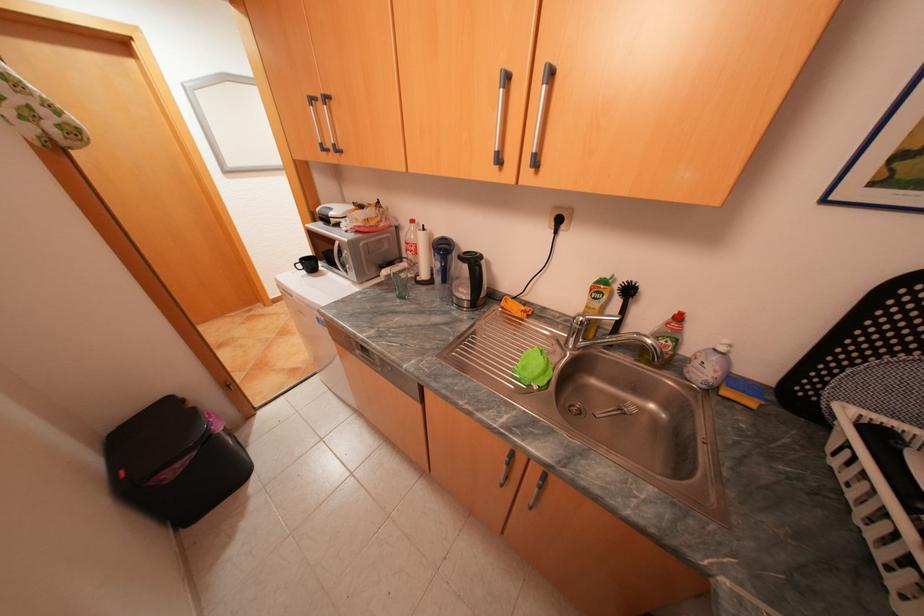
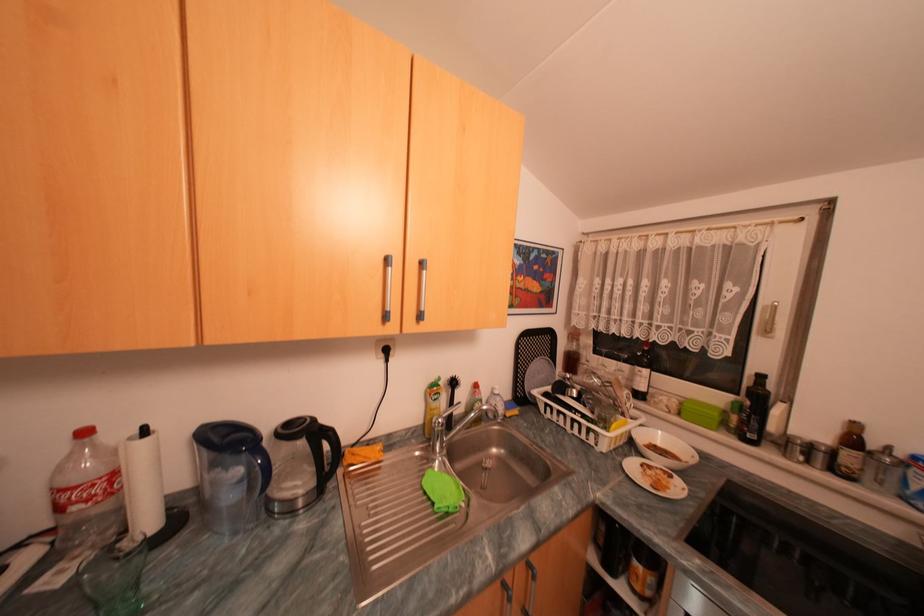
Question: How did the camera likely rotate?

Choices:
 (A) Left
 (B) Right
 (C) Up
 (D) Down

Answer: (B)